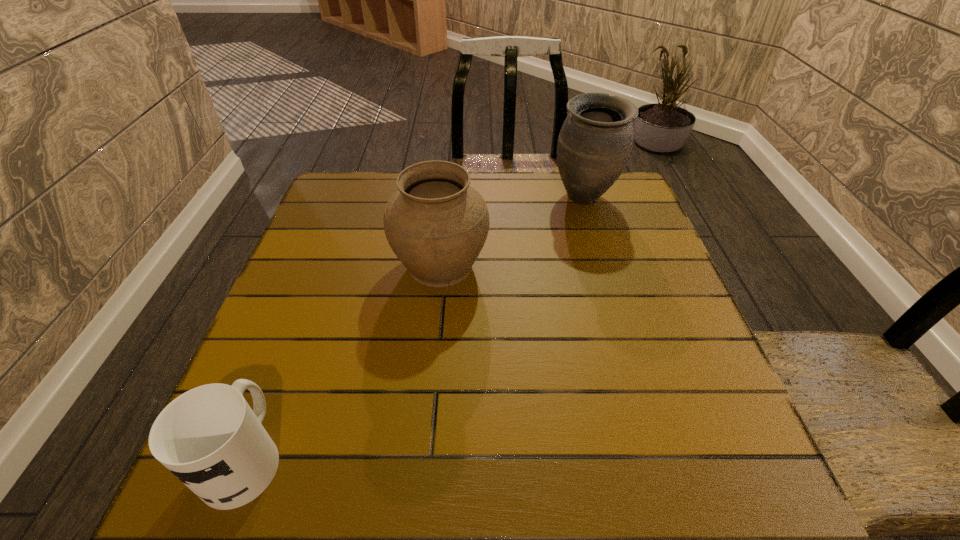
You are a GUI agent. You are given a task and a screenshot of the screen. Output one action in this format:
    pyautogui.click(x=<x>, y=<y>)
    Task: Click on the free region located 0.380m on the handle side of the mug
    The image size is (960, 540).
    Given the screenshot: What is the action you would take?
    pyautogui.click(x=320, y=264)

Where is `object that is at the far edge`? object that is at the far edge is located at coordinates (595, 142).

This screenshot has height=540, width=960. What are the coordinates of `object that is at the near edge` in the screenshot? It's located at (209, 437).

At what (x,y) coordinates should I click in order to perform the action: click on object present at the left edge. Please return your answer as a coordinate pair (x, y). Image resolution: width=960 pixels, height=540 pixels. Looking at the image, I should click on (209, 437).

Where is `object present at the right edge`? The image size is (960, 540). object present at the right edge is located at coordinates (595, 142).

Find the location of a particular element. This screenshot has width=960, height=540. object positioned at the near left corner is located at coordinates (209, 437).

This screenshot has height=540, width=960. Identify the location of object that is at the far right corner. (595, 142).

Find the location of a particular element. The width and height of the screenshot is (960, 540). free space at the far edge of the desktop is located at coordinates (477, 172).

Find the location of `vacant space at the near edge`. vacant space at the near edge is located at coordinates (584, 465).

What are the coordinates of `free space at the left edge of the desktop` in the screenshot? It's located at (346, 223).